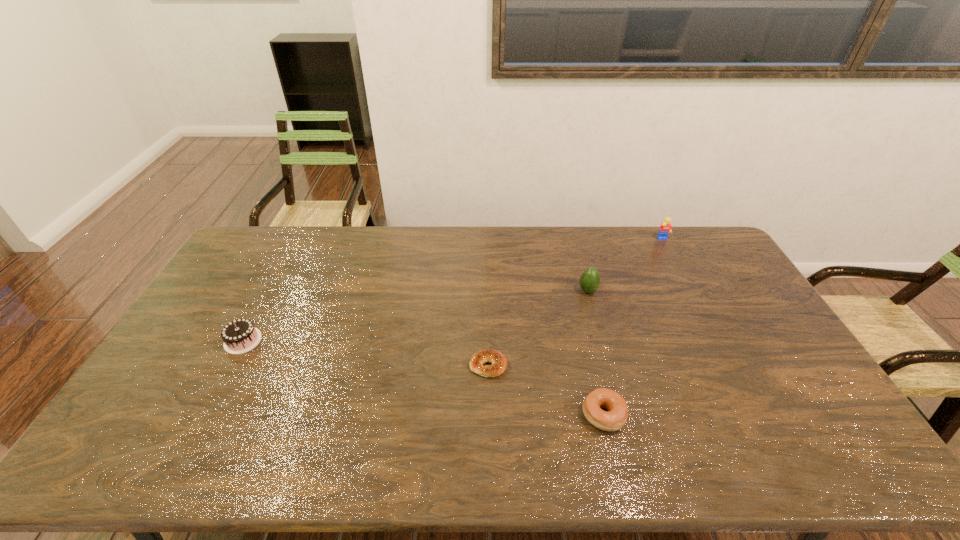
Find the location of a particular element. The height and width of the screenshot is (540, 960). the fourth closest object to the leftmost object is located at coordinates (665, 228).

Identify the location of the third closest object to the fourth nearest object. Image resolution: width=960 pixels, height=540 pixels. (616, 417).

Find the location of a particular element. The width and height of the screenshot is (960, 540). blank area in the image that satisfies the following two spatial constraints: 1. on the front side of the farther bagel; 2. on the right side of the leftmost object is located at coordinates (229, 366).